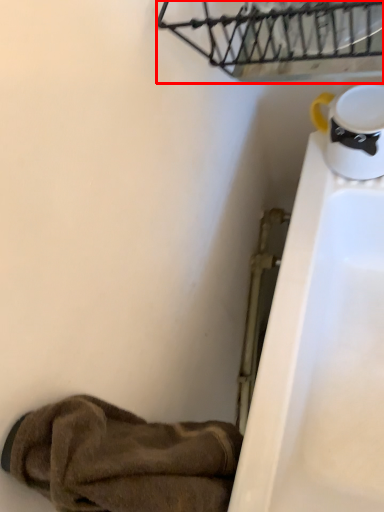
Question: Observing the image, what is the correct spatial positioning of basket (annotated by the red box) in reference to footwear?

Choices:
 (A) left
 (B) right

Answer: (B)